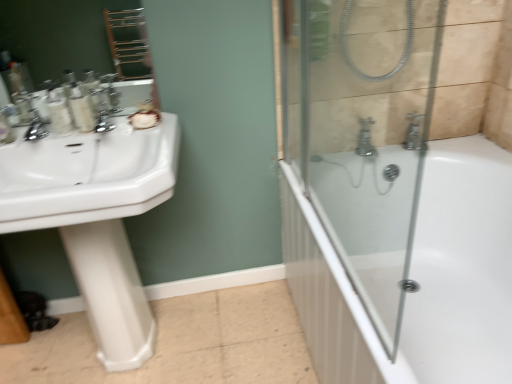
Question: Does matte plastic bottles at left, which appears as the first toiletry when viewed from the left, have a larger size compared to matte plastic bottles at left, the second toiletry positioned from the left?

Choices:
 (A) no
 (B) yes

Answer: (B)

Question: From a real-world perspective, is matte plastic bottles at left, which appears as the first toiletry when viewed from the left, on top of matte plastic bottles at left, acting as the first toiletry starting from the right?

Choices:
 (A) no
 (B) yes

Answer: (A)

Question: Does matte plastic bottles at left, the 2th toiletry positioned from the right, appear on the right side of matte plastic bottles at left, the second toiletry positioned from the left?

Choices:
 (A) yes
 (B) no

Answer: (B)

Question: Is matte plastic bottles at left, which appears as the first toiletry when viewed from the left, with matte plastic bottles at left, the second toiletry positioned from the left?

Choices:
 (A) no
 (B) yes

Answer: (B)

Question: Is matte plastic bottles at left, which appears as the first toiletry when viewed from the left, taller than matte plastic bottles at left, the second toiletry positioned from the left?

Choices:
 (A) no
 (B) yes

Answer: (A)

Question: Visually, is matte plastic bottles at left, the 2th toiletry positioned from the right, positioned to the left or to the right of white glossy sink at left?

Choices:
 (A) left
 (B) right

Answer: (A)

Question: Is matte plastic bottles at left, the 2th toiletry positioned from the right, situated inside white glossy sink at left or outside?

Choices:
 (A) inside
 (B) outside

Answer: (B)

Question: Based on their sizes in the image, would you say matte plastic bottles at left, which appears as the first toiletry when viewed from the left, is bigger or smaller than white glossy sink at left?

Choices:
 (A) big
 (B) small

Answer: (B)

Question: Does point (73, 127) appear closer or farther from the camera than point (14, 178)?

Choices:
 (A) closer
 (B) farther

Answer: (B)

Question: Considering the positions of point (69, 89) and point (17, 142), is point (69, 89) closer or farther from the camera than point (17, 142)?

Choices:
 (A) closer
 (B) farther

Answer: (A)

Question: From a real-world perspective, relative to white glossy sink at left, is matte plastic bottles at left, the second toiletry positioned from the left, vertically above or below?

Choices:
 (A) below
 (B) above

Answer: (B)

Question: Choose the correct answer: Is matte plastic bottles at left, the second toiletry positioned from the left, inside white glossy sink at left or outside it?

Choices:
 (A) outside
 (B) inside

Answer: (A)

Question: From the image's perspective, is matte plastic bottles at left, acting as the first toiletry starting from the right, positioned above or below white glossy sink at left?

Choices:
 (A) above
 (B) below

Answer: (A)

Question: From a real-world perspective, relative to white glossy pedestal at left, is white glossy sink at left vertically above or below?

Choices:
 (A) above
 (B) below

Answer: (A)

Question: From the image's perspective, is white glossy sink at left located above or below white glossy pedestal at left?

Choices:
 (A) above
 (B) below

Answer: (A)